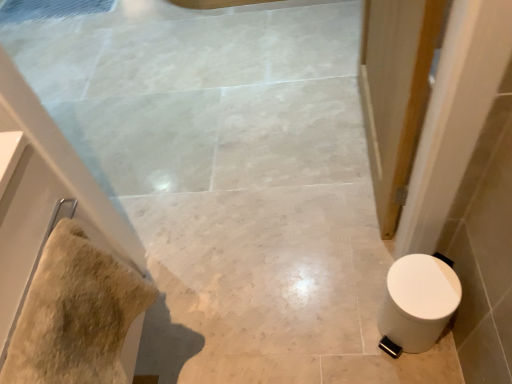
This screenshot has height=384, width=512. I want to click on beige fluffy towel at left, so pos(75,314).

What do you see at coordinates (75, 314) in the screenshot? The image size is (512, 384). I see `beige fluffy towel at left` at bounding box center [75, 314].

This screenshot has height=384, width=512. Describe the element at coordinates (417, 303) in the screenshot. I see `white glossy toilet at lower right` at that location.

The height and width of the screenshot is (384, 512). What are the coordinates of `white glossy toilet at lower right` in the screenshot? It's located at (417, 303).

At what (x,y) coordinates should I click in order to perform the action: click on beige fluffy towel at left. Please return your answer as a coordinate pair (x, y). Looking at the image, I should click on point(75,314).

Based on the photo, can you confirm if white glossy toilet at lower right is positioned to the right of beige fluffy towel at left?

Indeed, white glossy toilet at lower right is positioned on the right side of beige fluffy towel at left.

Which object is further away from the camera, white glossy toilet at lower right or beige fluffy towel at left?

white glossy toilet at lower right is further away from the camera.

Is point (407, 318) farther from viewer compared to point (129, 295)?

That is True.

From the image's perspective, relative to beige fluffy towel at left, is white glossy toilet at lower right above or below?

Based on their image positions, white glossy toilet at lower right is located beneath beige fluffy towel at left.

From a real-world perspective, does white glossy toilet at lower right sit lower than beige fluffy towel at left?

Yes, from a real-world perspective, white glossy toilet at lower right is below beige fluffy towel at left.

Which of these two, white glossy toilet at lower right or beige fluffy towel at left, is wider?

white glossy toilet at lower right.

Is white glossy toilet at lower right taller or shorter than beige fluffy towel at left?

Clearly, white glossy toilet at lower right is taller compared to beige fluffy towel at left.

Is white glossy toilet at lower right bigger or smaller than beige fluffy towel at left?

white glossy toilet at lower right is bigger than beige fluffy towel at left.

Choose the correct answer: Is white glossy toilet at lower right inside beige fluffy towel at left or outside it?

white glossy toilet at lower right is spatially situated outside beige fluffy towel at left.

Would you say white glossy toilet at lower right is a long distance from beige fluffy towel at left?

No, there isn't a large distance between white glossy toilet at lower right and beige fluffy towel at left.

Is white glossy toilet at lower right aimed at beige fluffy towel at left?

No, white glossy toilet at lower right is not oriented towards beige fluffy towel at left.

Measure the distance between white glossy toilet at lower right and beige fluffy towel at left.

A distance of 26.41 inches exists between white glossy toilet at lower right and beige fluffy towel at left.

The width and height of the screenshot is (512, 384). What are the coordinates of `toilet to the right of beige fluffy towel at left` in the screenshot? It's located at (417, 303).

In the scene shown: Does beige fluffy towel at left appear on the right side of white glossy toilet at lower right?

In fact, beige fluffy towel at left is to the left of white glossy toilet at lower right.

Who is more distant, beige fluffy towel at left or white glossy toilet at lower right?

white glossy toilet at lower right is more distant.

Which is farther, [22,367] or [392,355]?

Point [392,355]

From the image's perspective, relative to white glossy toilet at lower right, is beige fluffy towel at left above or below?

Clearly, from the image's perspective, beige fluffy towel at left is above white glossy toilet at lower right.

From a real-world perspective, between beige fluffy towel at left and white glossy toilet at lower right, who is vertically higher?

beige fluffy towel at left.

Is beige fluffy towel at left thinner than white glossy toilet at lower right?

Indeed, beige fluffy towel at left has a lesser width compared to white glossy toilet at lower right.

Based on the photo, considering the sizes of objects beige fluffy towel at left and white glossy toilet at lower right in the image provided, who is taller, beige fluffy towel at left or white glossy toilet at lower right?

white glossy toilet at lower right.

Considering the sizes of beige fluffy towel at left and white glossy toilet at lower right in the image, is beige fluffy towel at left bigger or smaller than white glossy toilet at lower right?

Considering their sizes, beige fluffy towel at left takes up less space than white glossy toilet at lower right.

Can we say beige fluffy towel at left lies outside white glossy toilet at lower right?

Yes, beige fluffy towel at left is located beyond the bounds of white glossy toilet at lower right.

Is beige fluffy towel at left not close to white glossy toilet at lower right?

No, there isn't a large distance between beige fluffy towel at left and white glossy toilet at lower right.

Is beige fluffy towel at left oriented towards white glossy toilet at lower right?

No, beige fluffy towel at left is not oriented towards white glossy toilet at lower right.

Locate an element on the screen. The width and height of the screenshot is (512, 384). material lying in front of the white glossy toilet at lower right is located at coordinates (75, 314).

Where is `toilet on the right of the beige fluffy towel at left`? Image resolution: width=512 pixels, height=384 pixels. toilet on the right of the beige fluffy towel at left is located at coordinates (417, 303).

Image resolution: width=512 pixels, height=384 pixels. Find the location of `toilet below the beige fluffy towel at left (from the image's perspective)`. toilet below the beige fluffy towel at left (from the image's perspective) is located at coordinates (417, 303).